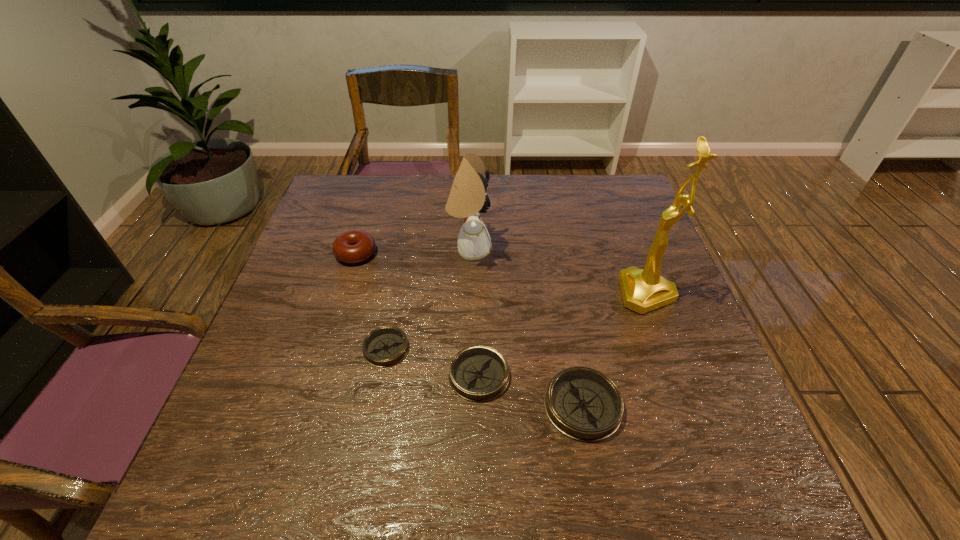
You are a GUI agent. You are given a task and a screenshot of the screen. Output one action in this format:
    pyautogui.click(x=<x>, y=<y>)
    Task: Click on the vacant area that lies between the shortest object and the fifth shortest object
    
    Given the screenshot: What is the action you would take?
    pyautogui.click(x=428, y=299)

At what (x,y) coordinates should I click in order to perform the action: click on vacant region between the doll and the fourth tallest object. Please return your answer as a coordinate pair (x, y). Looking at the image, I should click on (526, 328).

Identify the location of free area in between the second tallest compass and the doughnut. The height and width of the screenshot is (540, 960). (418, 314).

The image size is (960, 540). I want to click on free space between the second tallest compass and the award, so click(563, 334).

The height and width of the screenshot is (540, 960). I want to click on vacant point located between the tallest object and the third tallest object, so click(501, 273).

At what (x,y) coordinates should I click in order to perform the action: click on blank region between the second shortest compass and the doughnut. Please return your answer as a coordinate pair (x, y). This screenshot has width=960, height=540. Looking at the image, I should click on (418, 314).

Where is `vacant space that is in between the doughnut and the tallest object`? The image size is (960, 540). vacant space that is in between the doughnut and the tallest object is located at coordinates (501, 273).

Where is `free space between the doughnut and the shortest compass`? The image size is (960, 540). free space between the doughnut and the shortest compass is located at coordinates (371, 301).

Identify which object is the fourth closest to the doll. Please provide its 2D coordinates. Your answer should be formatted as a tuple, i.e. [(x, y)], where the tuple contains the x and y coordinates of a point satisfying the conditions above.

[(643, 290)]

Identify the location of object that is the fifth closest to the doll. The width and height of the screenshot is (960, 540). (584, 404).